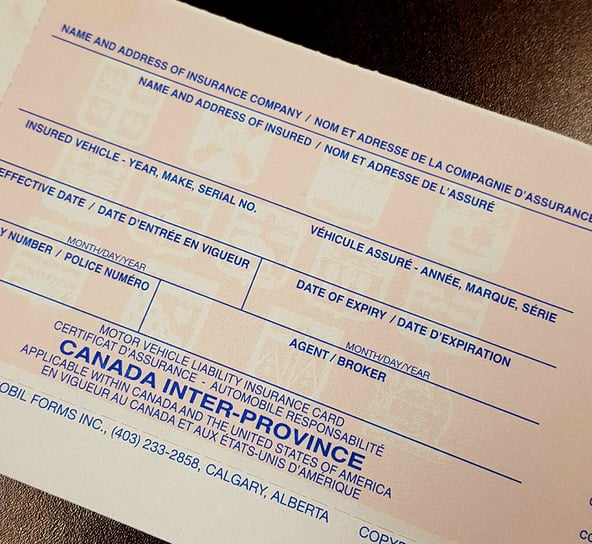
I want to click on table, so click(x=40, y=510).